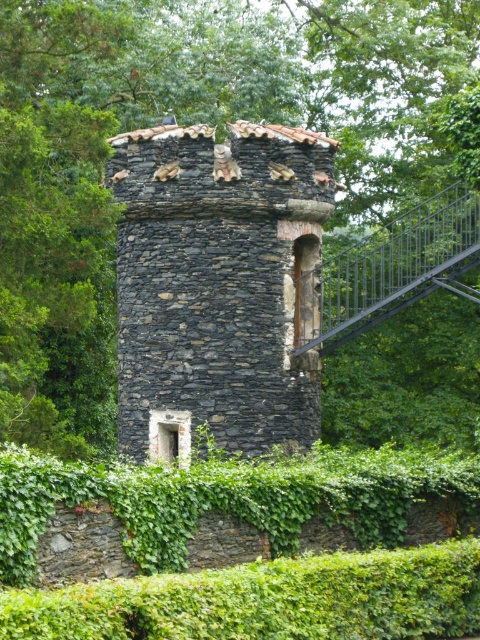
Question: Does green leafy tree at center have a larger size compared to rustic stone tower at center?

Choices:
 (A) no
 (B) yes

Answer: (B)

Question: Which point is closer to the camera?

Choices:
 (A) (199, 323)
 (B) (370, 10)

Answer: (A)

Question: Which of the following is the closest to the observer?

Choices:
 (A) (269, 32)
 (B) (257, 157)

Answer: (B)

Question: Is green leafy tree at center further to the viewer compared to rustic stone tower at center?

Choices:
 (A) no
 (B) yes

Answer: (A)

Question: Is green leafy tree at center in front of rustic stone tower at center?

Choices:
 (A) yes
 (B) no

Answer: (A)